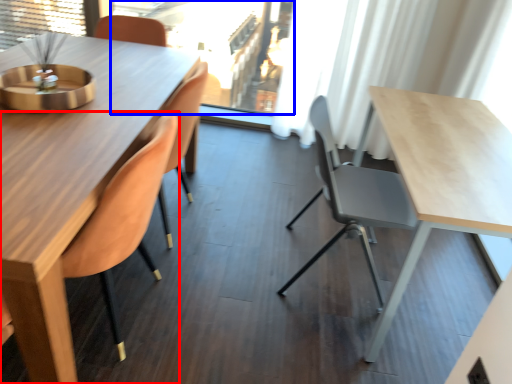
Question: Among these objects, which one is farthest to the camera, chair (highlighted by a red box) or window screen (highlighted by a blue box)?

Choices:
 (A) chair
 (B) window screen

Answer: (B)